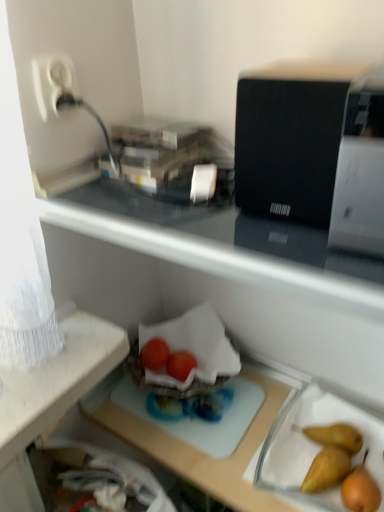
Question: Is transparent plastic tray at center to the left of white plastic plug at upper left from the viewer's perspective?

Choices:
 (A) yes
 (B) no

Answer: (B)

Question: From a real-world perspective, is transparent plastic tray at center on top of white plastic plug at upper left?

Choices:
 (A) yes
 (B) no

Answer: (B)

Question: From a real-world perspective, is transparent plastic tray at center under white plastic plug at upper left?

Choices:
 (A) yes
 (B) no

Answer: (A)

Question: Does transparent plastic tray at center have a lesser height compared to white plastic plug at upper left?

Choices:
 (A) yes
 (B) no

Answer: (B)

Question: Is the position of transparent plastic tray at center less distant than that of white plastic plug at upper left?

Choices:
 (A) no
 (B) yes

Answer: (B)

Question: From the image's perspective, would you say transparent plastic tray at center is positioned over white plastic plug at upper left?

Choices:
 (A) no
 (B) yes

Answer: (A)

Question: From a real-world perspective, is white glossy printer at upper right, arranged as the second appliance when viewed from the left, positioned under transparent plastic tray at center based on gravity?

Choices:
 (A) yes
 (B) no

Answer: (B)

Question: Is white glossy printer at upper right, which appears as the first appliance when viewed from the right, oriented towards transparent plastic tray at center?

Choices:
 (A) no
 (B) yes

Answer: (A)

Question: From the image's perspective, is white glossy printer at upper right, which appears as the first appliance when viewed from the right, on transparent plastic tray at center?

Choices:
 (A) no
 (B) yes

Answer: (B)

Question: Considering the relative positions of white glossy printer at upper right, arranged as the second appliance when viewed from the left, and transparent plastic tray at center in the image provided, is white glossy printer at upper right, arranged as the second appliance when viewed from the left, to the left of transparent plastic tray at center from the viewer's perspective?

Choices:
 (A) no
 (B) yes

Answer: (A)

Question: Considering the relative sizes of white glossy printer at upper right, arranged as the second appliance when viewed from the left, and transparent plastic tray at center in the image provided, is white glossy printer at upper right, arranged as the second appliance when viewed from the left, shorter than transparent plastic tray at center?

Choices:
 (A) yes
 (B) no

Answer: (A)

Question: From the image's perspective, would you say white glossy printer at upper right, which appears as the first appliance when viewed from the right, is shown under transparent plastic tray at center?

Choices:
 (A) yes
 (B) no

Answer: (B)

Question: From the image's perspective, does white glossy printer at upper right, arranged as the second appliance when viewed from the left, appear higher than glossy plastic tomatoes at center, which is the first green vegetables in right-to-left order?

Choices:
 (A) yes
 (B) no

Answer: (A)